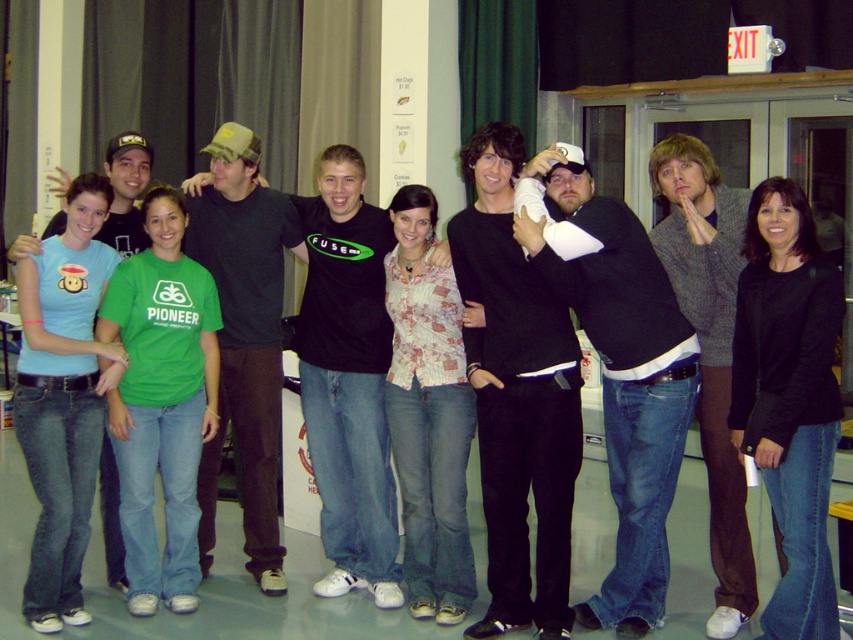
Question: Based on their relative distances, which object is farther from the black sweater at center?

Choices:
 (A) green cotton t-shirt at center
 (B) black matte jacket at center
 (C) light blue t-shirt at center

Answer: (C)

Question: Can you confirm if black matte jacket at center is bigger than light blue t-shirt at center?

Choices:
 (A) no
 (B) yes

Answer: (A)

Question: Among these objects, which one is nearest to the camera?

Choices:
 (A) black matte sweater at center
 (B) green cotton t-shirt at center
 (C) gray wool sweater at center
 (D) black sweater at center

Answer: (D)

Question: Does black matte jacket at center lie behind dark brown cotton pants at center?

Choices:
 (A) yes
 (B) no

Answer: (B)

Question: Can you confirm if green cotton t-shirt at center is wider than light blue t-shirt at center?

Choices:
 (A) no
 (B) yes

Answer: (A)

Question: Which object is closer to the camera taking this photo?

Choices:
 (A) black t-shirt at center
 (B) gray wool sweater at center

Answer: (B)